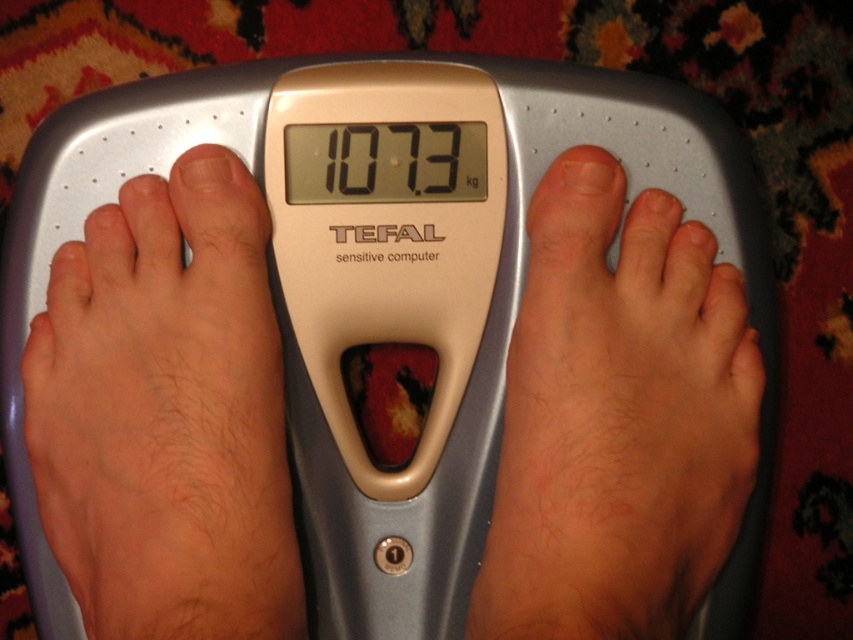
Does hair-covered skin at left have a lesser width compared to smooth skin foot at center?

Yes.

Who is more distant from viewer, (x=99, y=477) or (x=701, y=552)?

Point (x=701, y=552)

Identify the location of hair-covered skin at left. (166, 413).